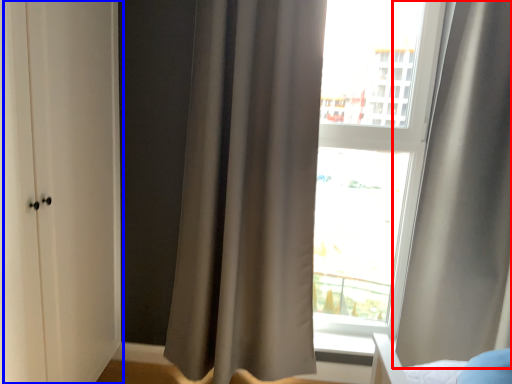
Question: Which object appears closest to the camera in this image, curtain (highlighted by a red box) or screen door (highlighted by a blue box)?

Choices:
 (A) curtain
 (B) screen door

Answer: (B)